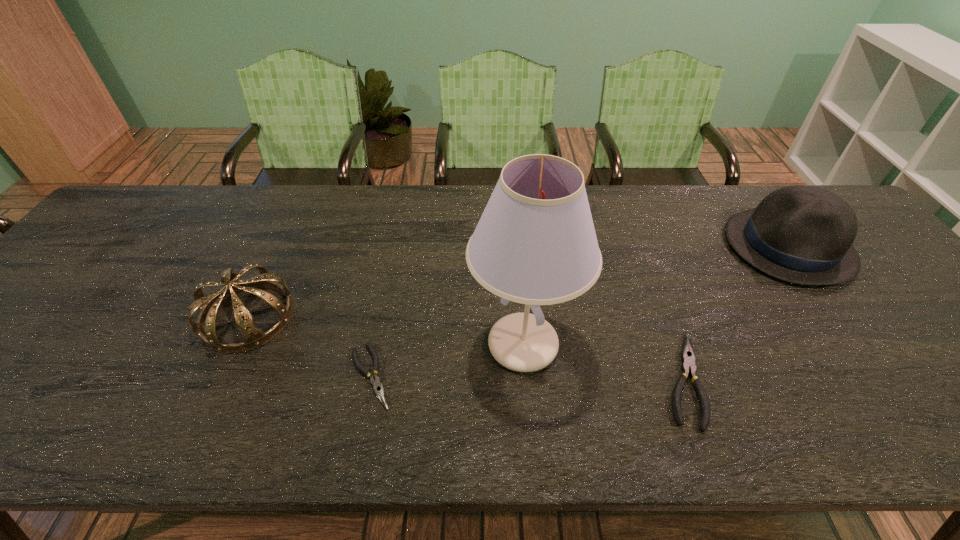
In the image, there is a desktop. Find the location of `vacant region at the far edge`. vacant region at the far edge is located at coordinates (436, 222).

Locate an element on the screen. vacant area at the near edge of the desktop is located at coordinates (590, 388).

You are a GUI agent. You are given a task and a screenshot of the screen. Output one action in this format:
    pyautogui.click(x=<x>, y=<y>)
    Task: Click on the free space at the left edge
    This screenshot has width=960, height=540.
    Given the screenshot: What is the action you would take?
    pyautogui.click(x=69, y=268)

The image size is (960, 540). In order to click on vacant space at the right edge of the desktop in this screenshot , I will do `click(948, 346)`.

Find the location of a particular element. This screenshot has height=540, width=960. free space at the far left corner of the desktop is located at coordinates (179, 200).

The image size is (960, 540). I want to click on blank area at the near left corner, so click(2, 383).

This screenshot has height=540, width=960. In order to click on vacant area between the right pliers and the shortest object in this screenshot , I will do `click(527, 377)`.

The image size is (960, 540). I want to click on free spot between the fourth object from left to right and the tiara, so [466, 348].

Where is `empty location between the left pliers and the third object from left to right`? This screenshot has width=960, height=540. empty location between the left pliers and the third object from left to right is located at coordinates (446, 360).

The height and width of the screenshot is (540, 960). Find the location of `vacant space in between the fourth tallest object and the leftmost object`. vacant space in between the fourth tallest object and the leftmost object is located at coordinates (466, 348).